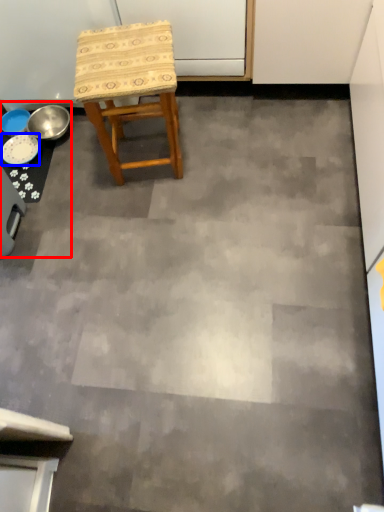
Question: Which object is further to the camera taking this photo, table (highlighted by a red box) or plate (highlighted by a blue box)?

Choices:
 (A) table
 (B) plate

Answer: (B)